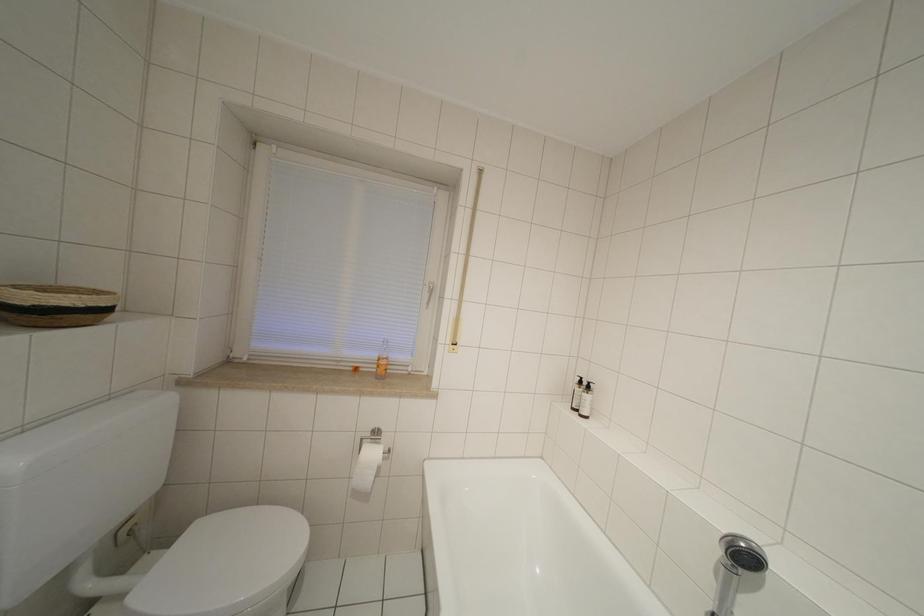
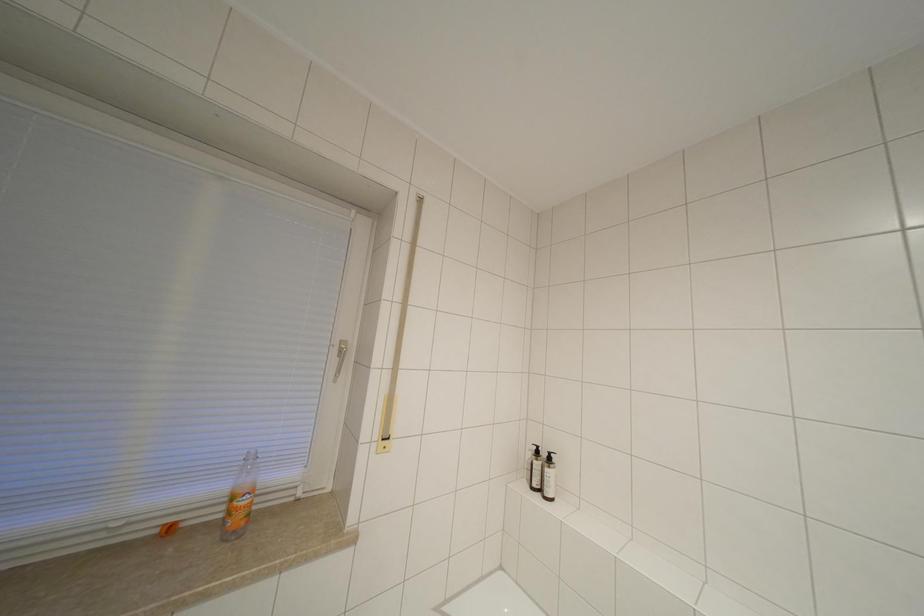
Consider the image. Which direction would the cameraman need to move to produce the second image?

The movement direction of the cameraman is left, forward.